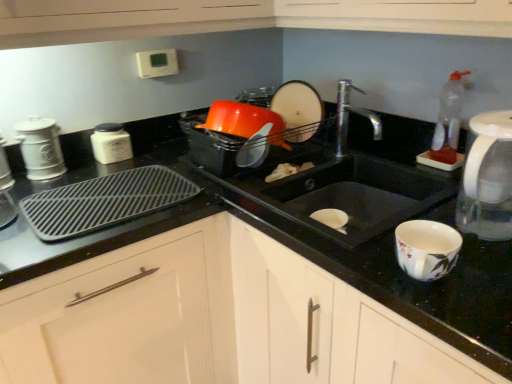
Question: In the image, is white matte jar at left, positioned as the third appliance in right-to-left order, positioned in front of or behind white matte cabinet at center?

Choices:
 (A) front
 (B) behind

Answer: (B)

Question: From a real-world perspective, is white matte jar at left, positioned as the third appliance in right-to-left order, physically located above or below white matte cabinet at center?

Choices:
 (A) above
 (B) below

Answer: (A)

Question: Which object is positioned closest to the black plastic tray at left?

Choices:
 (A) white ceramic canister at left, which ranks as the second appliance in left-to-right order
 (B) white plastic microwave at upper center, acting as the 4th appliance starting from the left
 (C) white matte jar at left, acting as the 3th appliance starting from the left
 (D) black matte sink at center
 (E) white matte cabinet at center

Answer: (A)

Question: Which object is the closest to the matte white plate at upper center, which is the 5th appliance in left-to-right order?

Choices:
 (A) white plastic microwave at upper center, the 2th appliance when ordered from right to left
 (B) white matte cabinet at center
 (C) white ceramic canister at left, which appears as the fourth appliance when viewed from the right
 (D) white matte jar at left, positioned as the third appliance in right-to-left order
 (E) white matte canister at left, which appears as the 1th appliance when viewed from the left

Answer: (A)